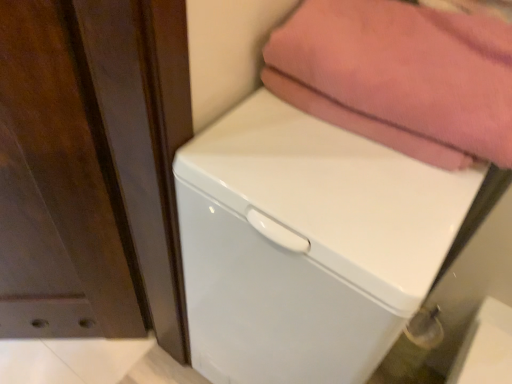
Question: From a real-world perspective, is pink cotton towel at upper right above or below white glossy dishwasher at center?

Choices:
 (A) above
 (B) below

Answer: (A)

Question: Is point (369, 87) closer or farther from the camera than point (365, 249)?

Choices:
 (A) farther
 (B) closer

Answer: (A)

Question: Is pink cotton towel at upper right bigger or smaller than white glossy dishwasher at center?

Choices:
 (A) big
 (B) small

Answer: (B)

Question: Is white glossy dishwasher at center spatially inside pink cotton towel at upper right, or outside of it?

Choices:
 (A) inside
 (B) outside

Answer: (B)

Question: Does point (264, 193) appear closer or farther from the camera than point (429, 59)?

Choices:
 (A) farther
 (B) closer

Answer: (B)

Question: From a real-world perspective, relative to pink cotton towel at upper right, is white glossy dishwasher at center vertically above or below?

Choices:
 (A) above
 (B) below

Answer: (B)

Question: Based on their positions, is white glossy dishwasher at center located to the left or right of pink cotton towel at upper right?

Choices:
 (A) right
 (B) left

Answer: (B)